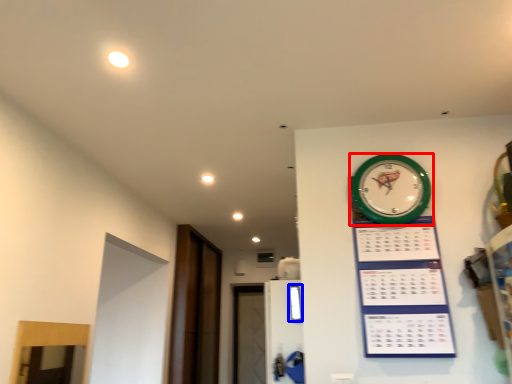
Question: Which object appears closest to the camera in this image, wall clock (highlighted by a red box) or window (highlighted by a blue box)?

Choices:
 (A) wall clock
 (B) window

Answer: (A)